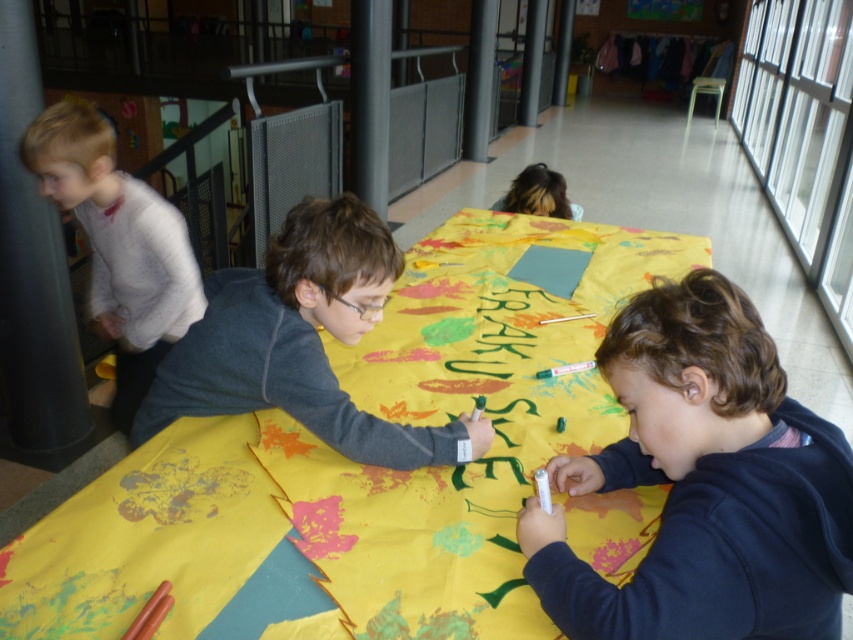
You are a teacher observing the children in the scene. You notice the yellow fabric at center and the dark gray sweater at center. Which object is bigger in size?

The yellow fabric at center is larger in size compared to the dark gray sweater at center.

You are a teacher observing the children in the scene. You need to determine if the yellow fabric at center can be fully covered by a large blanket that is the same size as the blonde hair at upper center. Can it be covered?

The yellow fabric at center is much taller than the blonde hair at upper center, so the blanket would not be large enough to fully cover it.

You are standing in the hallway and want to place a small stool to the right of the yellow fabric at center. Based on the coordinates provided, where should you place the stool?

The yellow fabric at center is located at coordinates point (361, 465). To place the stool to the right of it, you should position the stool at a coordinate with an x value greater than 0.727 while maintaining the same y value of 0.424.